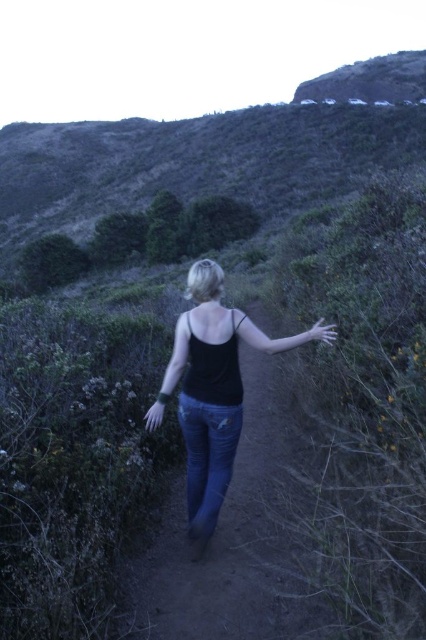
You are a fashion designer observing a model wearing a black matte tank top at center and denim at center. You need to adjust the length of the denim to ensure there is at least 36 inches between the bottom of the tank top and the top of the denim. Based on the current distance, is the denim too long, too short, or just right?

The current distance between the black matte tank top at center and denim at center is 33.94 inches. Since the required minimum distance is 36 inches, the denim is currently too long, as it reduces the space between them below the desired threshold.

You are a photographer trying to capture the person in the scene. Since you want to focus on the black matte tank top at center and denim at center, which clothing item should you adjust your camera focus on first based on their positions?

The denim at center is behind the black matte tank top at center, so you should focus on the black matte tank top at center first since it is closer to the camera.

You are a drone operator trying to capture a photo of the person walking on the path. The camera is set to focus on the center of the image. Since the black matte tank top at center is the main subject, will the camera focus on it?

The black matte tank top at center is located at point (213, 388), which is close to the center of the image. Therefore, the camera will focus on the black matte tank top at center since it is near the center point.